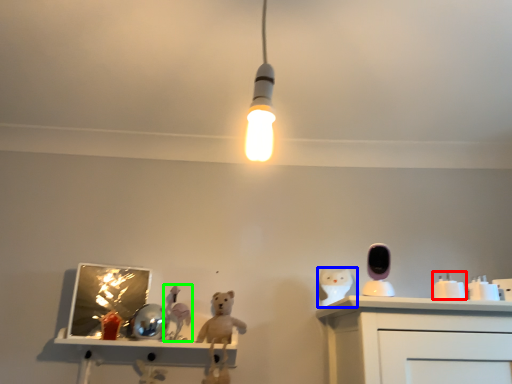
Question: Considering the real-world distances, which object is closest to toy (highlighted by a red box)? animal (highlighted by a blue box) or toy (highlighted by a green box).

Choices:
 (A) animal
 (B) toy

Answer: (A)